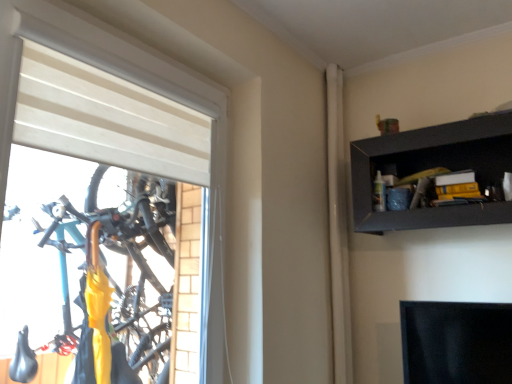
Question: Is point (335, 230) closer or farther from the camera than point (358, 162)?

Choices:
 (A) closer
 (B) farther

Answer: (B)

Question: From a real-world perspective, is white matte curtain at upper right above or below black matte shelf at upper right?

Choices:
 (A) below
 (B) above

Answer: (A)

Question: Estimate the real-world distances between objects in this image. Which object is farther from the black matte shelf at upper right?

Choices:
 (A) white matte window at left
 (B) white matte curtain at upper right

Answer: (A)

Question: Which object is positioned closest to the black matte shelf at upper right?

Choices:
 (A) white matte window at left
 (B) white matte curtain at upper right

Answer: (B)